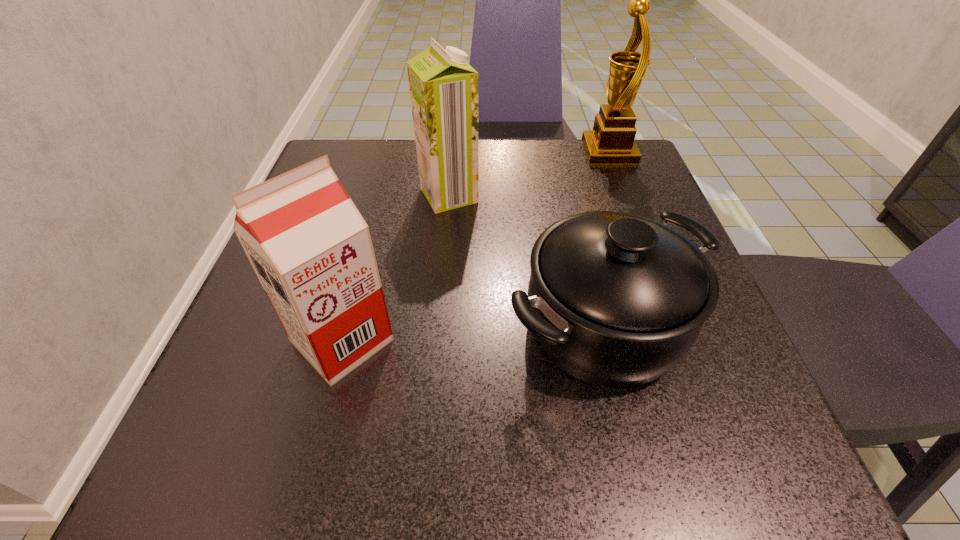
Identify the location of vacant space located on the right of the nearer soya milk. (565, 341).

Find the location of a particular element. free space located 0.110m on the left of the saucepan is located at coordinates (436, 325).

The height and width of the screenshot is (540, 960). Identify the location of award positioned at the far edge. (611, 142).

You are a GUI agent. You are given a task and a screenshot of the screen. Output one action in this format:
    pyautogui.click(x=<x>, y=<y>)
    Task: Click on the soya milk present at the far edge
    Image resolution: width=960 pixels, height=540 pixels.
    Given the screenshot: What is the action you would take?
    pyautogui.click(x=443, y=87)

Where is `object that is at the left edge`? The image size is (960, 540). object that is at the left edge is located at coordinates (311, 249).

Where is `award that is at the right edge`? This screenshot has width=960, height=540. award that is at the right edge is located at coordinates (611, 142).

What are the coordinates of `saucepan at the right edge` in the screenshot? It's located at (615, 299).

Where is `object at the far right corner`? This screenshot has width=960, height=540. object at the far right corner is located at coordinates (611, 142).

Where is `free space at the far edge of the desktop`? Image resolution: width=960 pixels, height=540 pixels. free space at the far edge of the desktop is located at coordinates (404, 170).

The image size is (960, 540). Identify the location of vacant space at the near edge of the desktop. (496, 435).